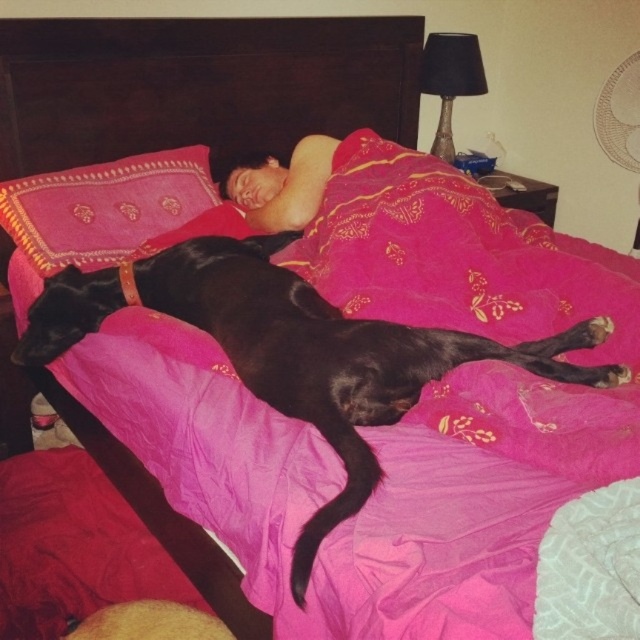
You are a furniture designer planning to create a new bed that accommodates both the black smooth dog at center and the smooth skin person at center comfortably. Based on the scene, which one requires more horizontal space on the bed?

The black smooth dog at center requires more horizontal space on the bed because its width surpasses that of the smooth skin person at center.

You are taking a photo of the bed and want to focus on the point closer to the camera. Which point should you choose between point (268, 358) and point (44, 204)?

Point (268, 358) is closer to the camera than point (44, 204), so you should focus on point (268, 358).

You are a furniture designer evaluating the bed for potential modifications. Considering the black smooth dog at center and the pink embroidered pillow at upper left, which object would require adjustments in height if the pillow needs to be taller than the dog?

The black smooth dog at center is taller than the pink embroidered pillow at upper left, so to make the pillow taller than the dog, the pillow would need to be adjusted to increase its height.